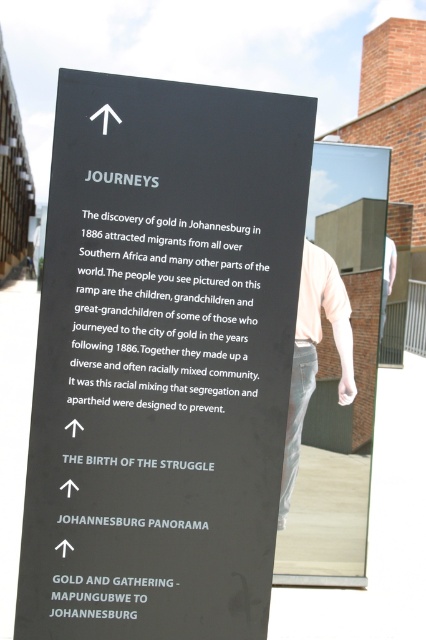
Question: Can you confirm if black matte sign at upper center is positioned to the right of white cotton shirt at center?

Choices:
 (A) yes
 (B) no

Answer: (B)

Question: Is black matte sign at upper center below white cotton shirt at center?

Choices:
 (A) no
 (B) yes

Answer: (A)

Question: Which of the following is the farthest from the observer?

Choices:
 (A) (311, 326)
 (B) (97, 273)

Answer: (A)

Question: Does black matte sign at upper center have a lesser width compared to white cotton shirt at center?

Choices:
 (A) yes
 (B) no

Answer: (B)

Question: Which point is closer to the camera?

Choices:
 (A) (271, 179)
 (B) (311, 268)

Answer: (A)

Question: Which of the following is the farthest from the observer?

Choices:
 (A) (328, 294)
 (B) (273, 461)

Answer: (A)